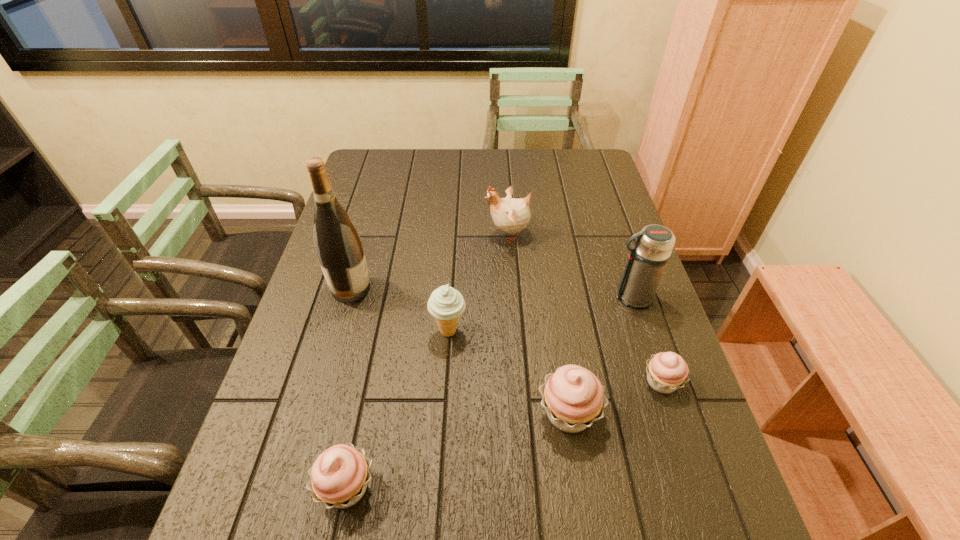
Where is `empty space that is in between the rightmost cupcake and the second cupcake from right to left`? The width and height of the screenshot is (960, 540). empty space that is in between the rightmost cupcake and the second cupcake from right to left is located at coordinates (615, 397).

Locate an element on the screen. The height and width of the screenshot is (540, 960). vacant space in between the thermos bottle and the bird is located at coordinates (570, 266).

Locate which object is the second closest to the leftmost cupcake. Please provide its 2D coordinates. Your answer should be formatted as a tuple, i.e. [(x, y)], where the tuple contains the x and y coordinates of a point satisfying the conditions above.

[(573, 397)]

Locate an element on the screen. Image resolution: width=960 pixels, height=540 pixels. object that ranks as the sixth closest to the tallest cupcake is located at coordinates (338, 246).

You are a GUI agent. You are given a task and a screenshot of the screen. Output one action in this format:
    pyautogui.click(x=<x>, y=<y>)
    Task: Click on the third closest cupcake relative to the second tallest object
    This screenshot has height=540, width=960.
    Given the screenshot: What is the action you would take?
    pyautogui.click(x=339, y=476)

You are a GUI agent. You are given a task and a screenshot of the screen. Output one action in this format:
    pyautogui.click(x=<x>, y=<y>)
    Task: Click on the cupcake object that ranks as the closest to the fourth farthest object
    The height and width of the screenshot is (540, 960).
    Given the screenshot: What is the action you would take?
    pyautogui.click(x=573, y=397)

Locate an element on the screen. vacant space that satisfies the following two spatial constraints: 1. on the label of the wine bottle; 2. on the left side of the second cupcake from right to left is located at coordinates (316, 413).

At what (x,y) coordinates should I click in order to perform the action: click on vacant area in the image that satisfies the following two spatial constraints: 1. on the back side of the shortest object; 2. at the beak of the farthest object. Please return your answer as a coordinate pair (x, y). The height and width of the screenshot is (540, 960). Looking at the image, I should click on (612, 234).